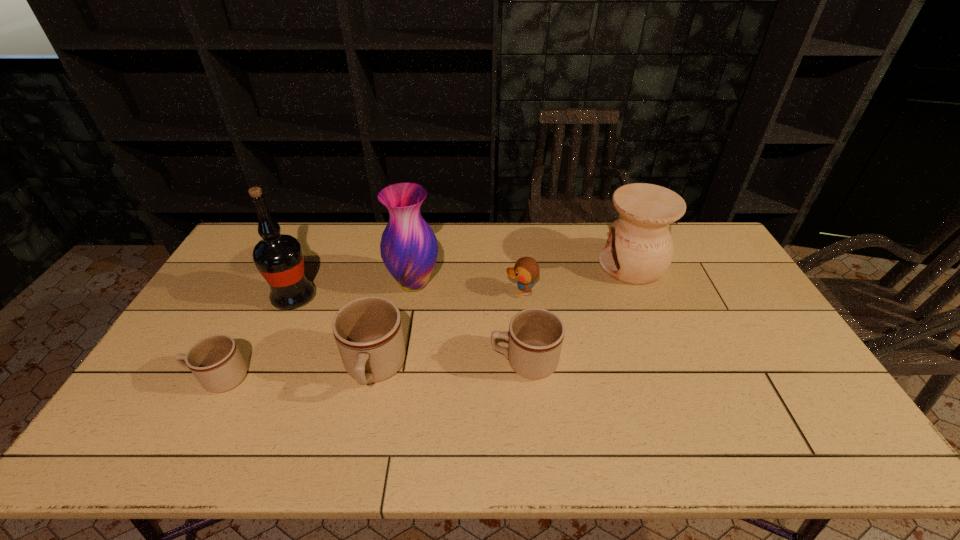
The width and height of the screenshot is (960, 540). I want to click on free spot that satisfies the following two spatial constraints: 1. at the open side of the fifth shortest object; 2. on the side of the fourth tallest object with the handle, so (676, 370).

The width and height of the screenshot is (960, 540). In order to click on free location that satisfies the following two spatial constraints: 1. on the back side of the second tallest object; 2. on the right side of the wine bottle in this screenshot , I will do `click(300, 283)`.

Locate an element on the screen. vacant region that satisfies the following two spatial constraints: 1. on the side of the vase with the handle; 2. on the right side of the shortest mug is located at coordinates (271, 283).